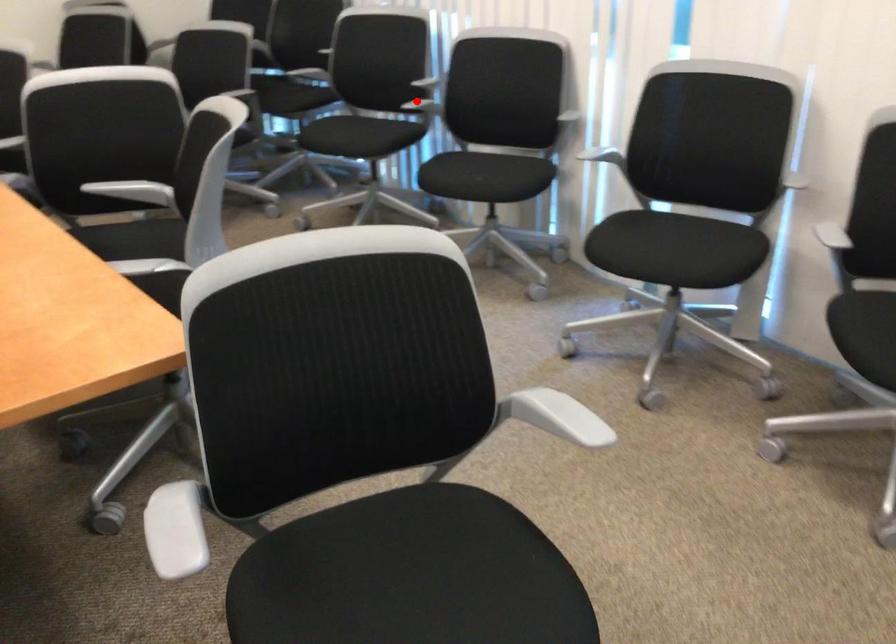
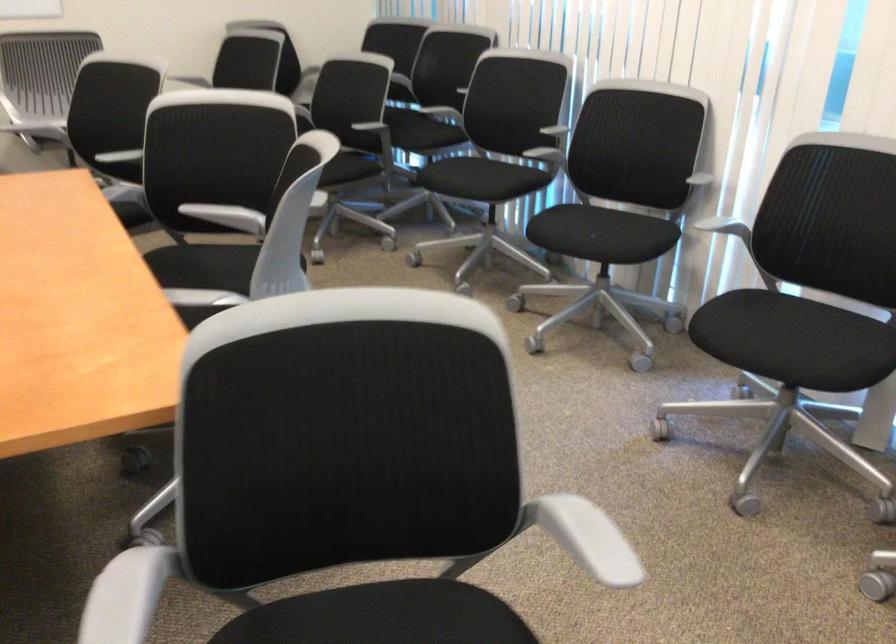
Where in the second image is the point corresponding to the highlighted location from the first image?

(543, 146)